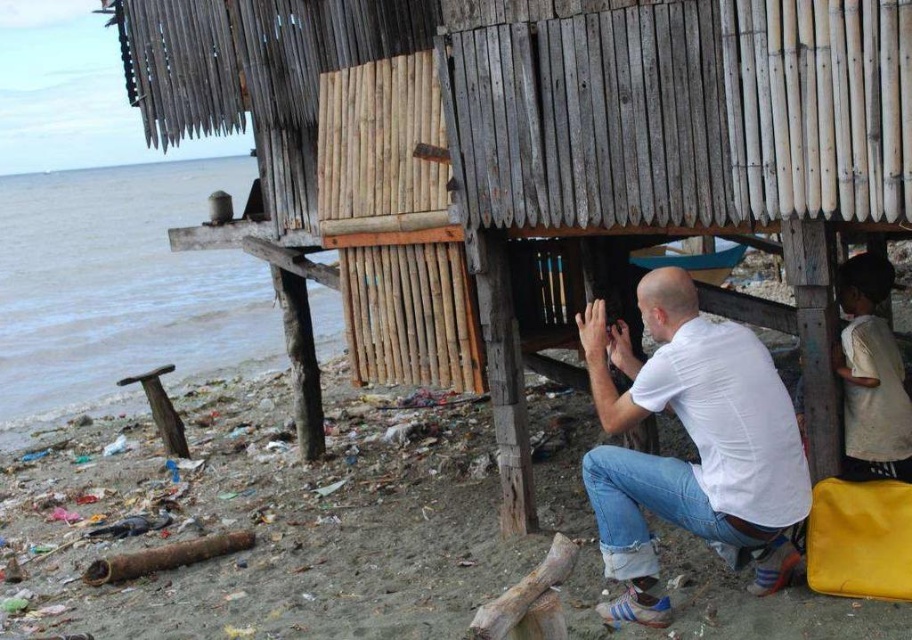
Question: Which point is closer to the camera taking this photo?

Choices:
 (A) (591, 474)
 (B) (468, 445)

Answer: (A)

Question: Estimate the real-world distances between objects in this image. Which object is closer to the wooden hut at center?

Choices:
 (A) white matte shirt at lower center
 (B) white cotton shirt at lower right
 (C) dirty sand at lower left
 (D) blue water at lower left

Answer: (A)

Question: Is wooden hut at center bigger than white matte shirt at lower center?

Choices:
 (A) no
 (B) yes

Answer: (B)

Question: Can you confirm if dirty sand at lower left is bigger than white matte shirt at lower center?

Choices:
 (A) no
 (B) yes

Answer: (A)

Question: Which of the following is the farthest from the observer?

Choices:
 (A) white matte shirt at lower center
 (B) blue water at lower left
 (C) white cotton shirt at lower right
 (D) dirty sand at lower left

Answer: (B)

Question: Does blue water at lower left have a lesser width compared to white cotton shirt at lower right?

Choices:
 (A) no
 (B) yes

Answer: (A)